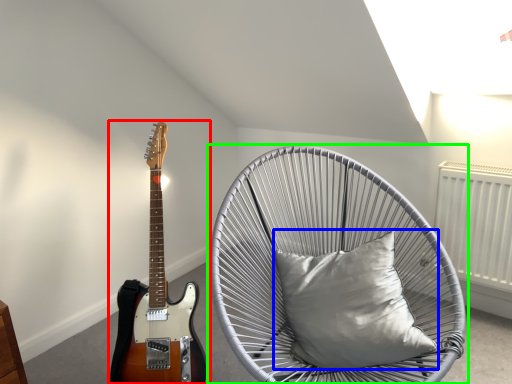
Question: Which is farther away from guitar (highlighted by a red box)? pillow (highlighted by a blue box) or chair (highlighted by a green box)?

Choices:
 (A) pillow
 (B) chair

Answer: (A)